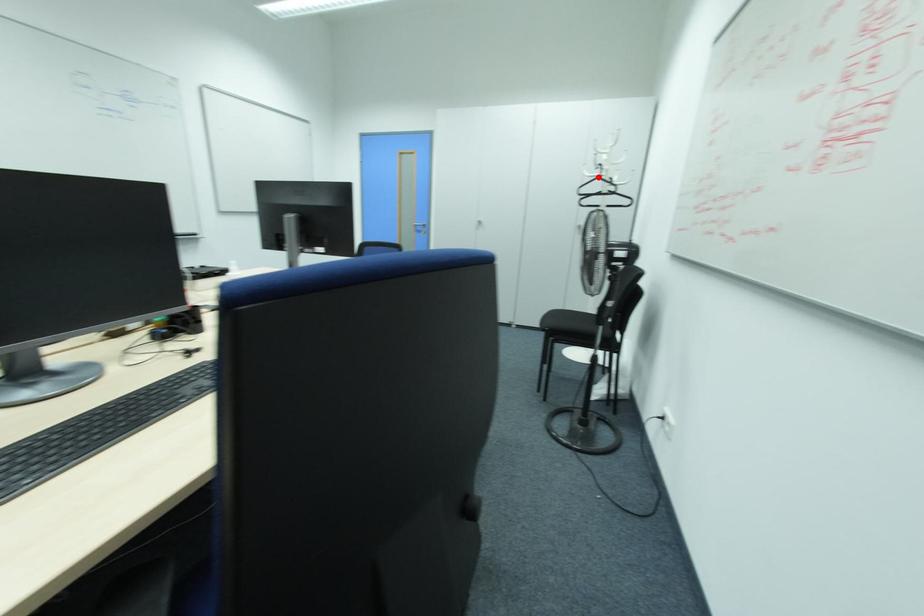
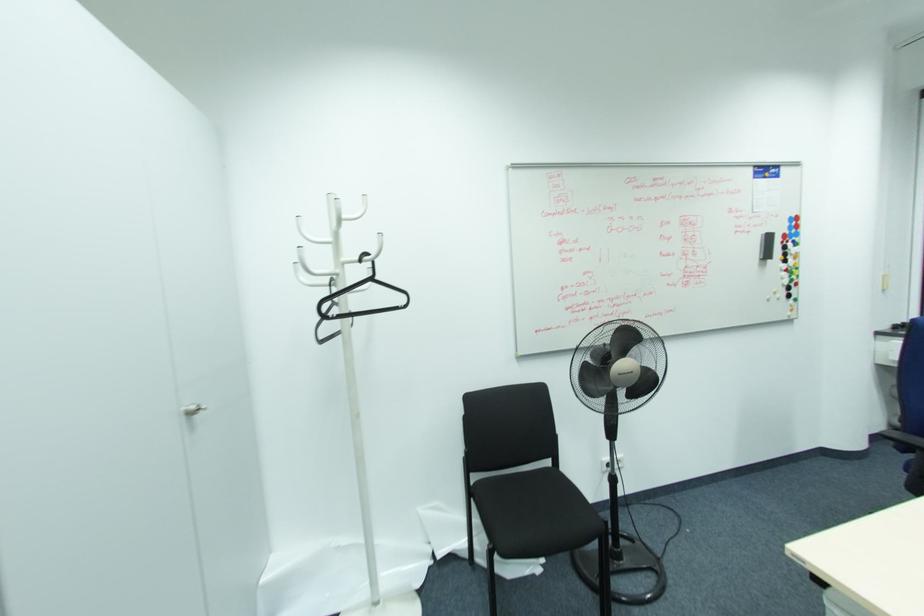
In the second image, find the point that corresponds to the highlighted location in the first image.

(371, 280)